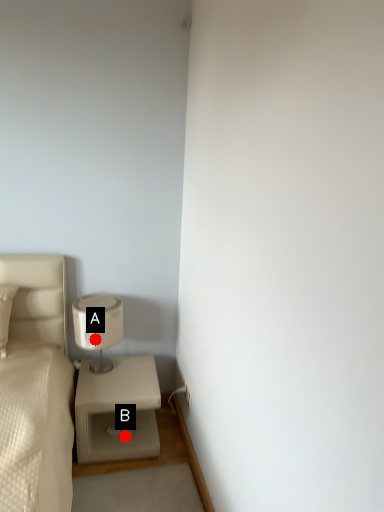
Question: Two points are circled on the image, labeled by A and B beside each circle. Which of the following is the closest to the observer?

Choices:
 (A) A is closer
 (B) B is closer

Answer: (B)